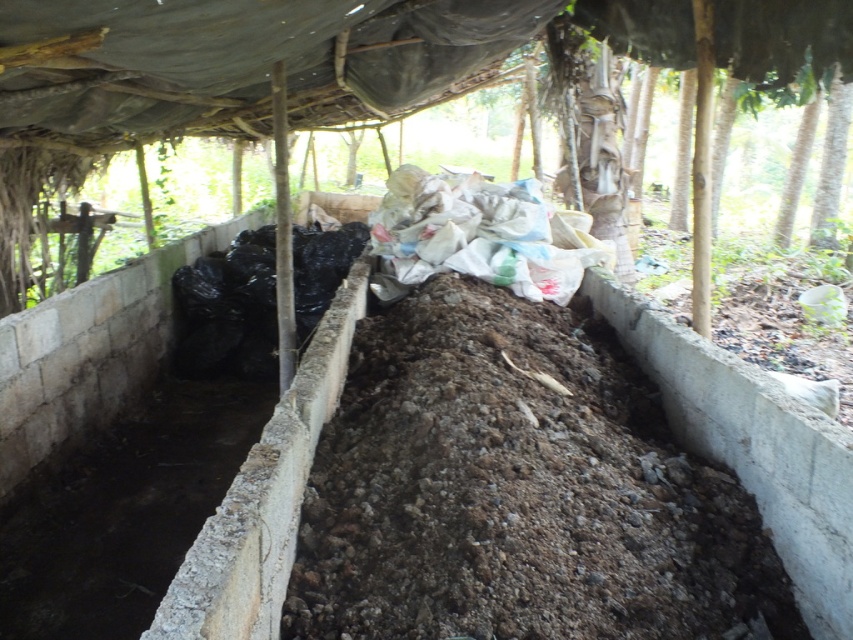
Is white paper at center wider than black plastic bag at left?

Yes.

Is point (415, 250) positioned behind point (225, 371)?

No, it is in front of (225, 371).

Who is more distant from viewer, (434,257) or (193,280)?

Point (193,280)

This screenshot has height=640, width=853. In order to click on white paper at center in this screenshot , I will do `click(483, 234)`.

Which of these two, brown soil at center or white paper at center, stands shorter?

brown soil at center

Between brown soil at center and white paper at center, which one is positioned lower?

brown soil at center is lower down.

Does point (704, 552) come farther from viewer compared to point (496, 196)?

No, (704, 552) is in front of (496, 196).

The width and height of the screenshot is (853, 640). Find the location of `brown soil at center`. brown soil at center is located at coordinates (518, 492).

Is brown soil at center behind black plastic bag at left?

That is False.

Describe the element at coordinates (518, 492) in the screenshot. This screenshot has height=640, width=853. I see `brown soil at center` at that location.

I want to click on brown soil at center, so click(518, 492).